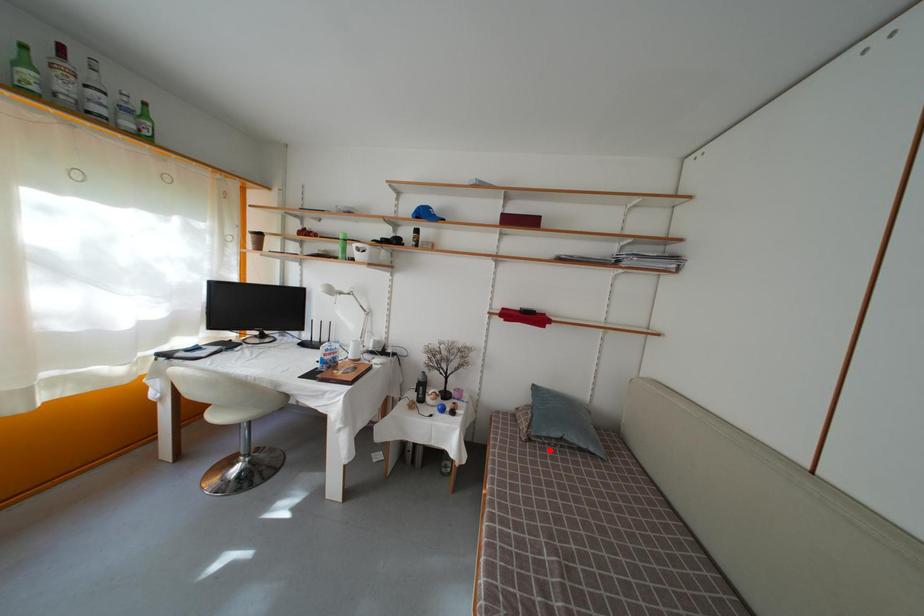
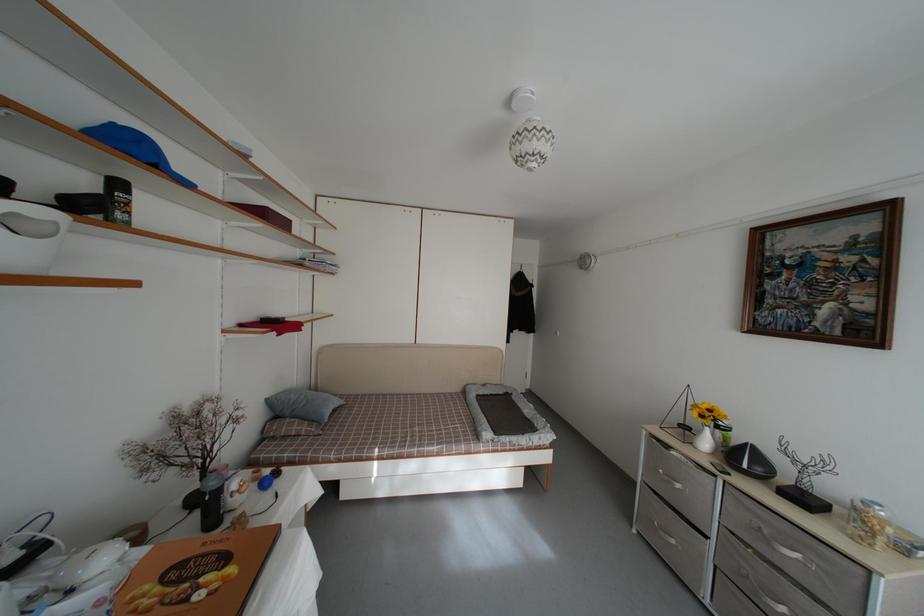
Where in the second image is the point corresponding to the highlighted location from the first image?

(332, 431)